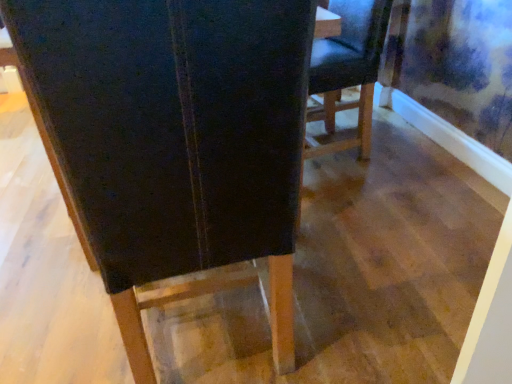
The image size is (512, 384). What are the coordinates of `matte black chair at center, arranged as the first chair when viewed from the back` in the screenshot? It's located at (347, 72).

What is the approximate height of matte black chair at center, which is the 2th chair from front to back?

It is 28.73 inches.

Describe the element at coordinates (347, 72) in the screenshot. The image size is (512, 384). I see `matte black chair at center, which is counted as the 2th chair, starting from the left` at that location.

What do you see at coordinates (175, 140) in the screenshot?
I see `black leather chair at center, the 2th chair positioned from the right` at bounding box center [175, 140].

Identify the location of black leather chair at center, which ranks as the 1th chair in front-to-back order. click(175, 140).

Based on the photo, how much space does black leather chair at center, which appears as the first chair when viewed from the left, occupy vertically?

black leather chair at center, which appears as the first chair when viewed from the left, is 36.51 inches tall.

You are a GUI agent. You are given a task and a screenshot of the screen. Output one action in this format:
    pyautogui.click(x=<x>, y=<y>)
    Task: Click on the matte black chair at center, which is counted as the 2th chair, starting from the left
    This screenshot has height=384, width=512.
    Given the screenshot: What is the action you would take?
    pyautogui.click(x=347, y=72)

Which is more to the right, matte black chair at center, which is counted as the 2th chair, starting from the left, or black leather chair at center, the 2th chair positioned from the right?

matte black chair at center, which is counted as the 2th chair, starting from the left.

In the image, is matte black chair at center, the first chair viewed from the right, positioned in front of or behind black leather chair at center, arranged as the second chair when viewed from the back?

In the image, matte black chair at center, the first chair viewed from the right, appears behind black leather chair at center, arranged as the second chair when viewed from the back.

Is point (377, 53) more distant than point (152, 218)?

Yes, it is behind point (152, 218).

From the image's perspective, is matte black chair at center, which is the 2th chair from front to back, located above or below black leather chair at center, the 2th chair positioned from the right?

Based on their image positions, matte black chair at center, which is the 2th chair from front to back, is located above black leather chair at center, the 2th chair positioned from the right.

From a real-world perspective, which object rests below the other?

matte black chair at center, arranged as the first chair when viewed from the back, from a real-world perspective.

Is matte black chair at center, which is the 2th chair from front to back, thinner than black leather chair at center, which ranks as the 1th chair in front-to-back order?

Yes, matte black chair at center, which is the 2th chair from front to back, is thinner than black leather chair at center, which ranks as the 1th chair in front-to-back order.

Considering the sizes of objects matte black chair at center, the first chair viewed from the right, and black leather chair at center, which ranks as the 1th chair in front-to-back order, in the image provided, who is shorter, matte black chair at center, the first chair viewed from the right, or black leather chair at center, which ranks as the 1th chair in front-to-back order,?

With less height is matte black chair at center, the first chair viewed from the right.

Does matte black chair at center, arranged as the first chair when viewed from the back, have a smaller size compared to black leather chair at center, which appears as the first chair when viewed from the left?

Indeed, matte black chair at center, arranged as the first chair when viewed from the back, has a smaller size compared to black leather chair at center, which appears as the first chair when viewed from the left.

In the scene shown: Can we say matte black chair at center, which is the 2th chair from front to back, lies outside black leather chair at center, arranged as the second chair when viewed from the back?

Yes, matte black chair at center, which is the 2th chair from front to back, is located beyond the bounds of black leather chair at center, arranged as the second chair when viewed from the back.

Is matte black chair at center, arranged as the first chair when viewed from the back, next to black leather chair at center, the 2th chair positioned from the right?

matte black chair at center, arranged as the first chair when viewed from the back, and black leather chair at center, the 2th chair positioned from the right, are not in contact.

Is matte black chair at center, which is counted as the 2th chair, starting from the left, looking in the opposite direction of black leather chair at center, arranged as the second chair when viewed from the back?

matte black chair at center, which is counted as the 2th chair, starting from the left, is not turned away from black leather chair at center, arranged as the second chair when viewed from the back.

This screenshot has height=384, width=512. In order to click on chair located above the black leather chair at center, arranged as the second chair when viewed from the back (from the image's perspective) in this screenshot , I will do `click(347, 72)`.

Can you confirm if black leather chair at center, arranged as the second chair when viewed from the back, is positioned to the right of matte black chair at center, which is counted as the 2th chair, starting from the left?

No, black leather chair at center, arranged as the second chair when viewed from the back, is not to the right of matte black chair at center, which is counted as the 2th chair, starting from the left.

Does black leather chair at center, arranged as the second chair when viewed from the back, lie in front of matte black chair at center, the first chair viewed from the right?

That is True.

Is point (93, 218) in front of point (326, 81)?

Yes, it is.

From the image's perspective, which one is positioned higher, black leather chair at center, which appears as the first chair when viewed from the left, or matte black chair at center, the first chair viewed from the right?

matte black chair at center, the first chair viewed from the right.

From a real-world perspective, which object rests below the other?

matte black chair at center, which is the 2th chair from front to back.

Considering the relative sizes of black leather chair at center, the 2th chair positioned from the right, and matte black chair at center, which is the 2th chair from front to back, in the image provided, is black leather chair at center, the 2th chair positioned from the right, thinner than matte black chair at center, which is the 2th chair from front to back,?

No, black leather chair at center, the 2th chair positioned from the right, is not thinner than matte black chair at center, which is the 2th chair from front to back.

Is black leather chair at center, the 2th chair positioned from the right, shorter than matte black chair at center, which is counted as the 2th chair, starting from the left?

No.

In the scene shown: Does black leather chair at center, the 2th chair positioned from the right, have a larger size compared to matte black chair at center, which is the 2th chair from front to back?

Indeed, black leather chair at center, the 2th chair positioned from the right, has a larger size compared to matte black chair at center, which is the 2th chair from front to back.

Would you say black leather chair at center, arranged as the second chair when viewed from the back, is inside or outside matte black chair at center, arranged as the first chair when viewed from the back?

black leather chair at center, arranged as the second chair when viewed from the back, lies outside matte black chair at center, arranged as the first chair when viewed from the back.

Would you say black leather chair at center, the 2th chair positioned from the right, is a long distance from matte black chair at center, which is counted as the 2th chair, starting from the left?

Yes.

Is black leather chair at center, arranged as the second chair when viewed from the back, positioned with its back to matte black chair at center, arranged as the first chair when viewed from the back?

No, black leather chair at center, arranged as the second chair when viewed from the back, is not facing away from matte black chair at center, arranged as the first chair when viewed from the back.

How distant is black leather chair at center, arranged as the second chair when viewed from the back, from matte black chair at center, which is the 2th chair from front to back?

They are 3.86 feet apart.

Where is `chair lying above the black leather chair at center, arranged as the second chair when viewed from the back (from the image's perspective)`? This screenshot has height=384, width=512. chair lying above the black leather chair at center, arranged as the second chair when viewed from the back (from the image's perspective) is located at coordinates (347, 72).

Locate an element on the screen. The width and height of the screenshot is (512, 384). chair below the black leather chair at center, the 2th chair positioned from the right (from a real-world perspective) is located at coordinates (347, 72).

Find the location of a particular element. This screenshot has width=512, height=384. chair lying behind the black leather chair at center, arranged as the second chair when viewed from the back is located at coordinates (347, 72).